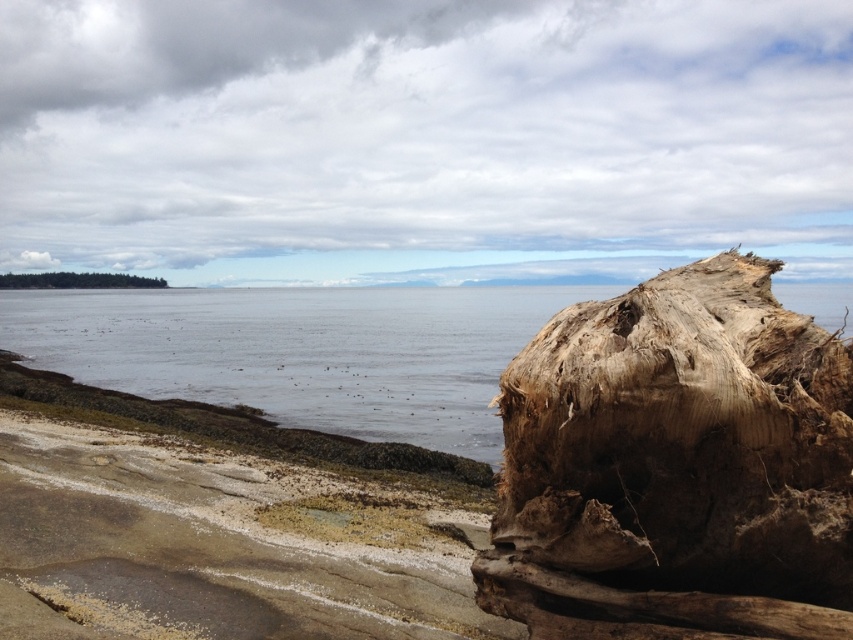
Question: Which point is farther to the camera?

Choices:
 (A) clear water at center
 (B) brown rough log at left

Answer: (B)

Question: Where is driftwood log at right located in relation to brown rough log at left in the image?

Choices:
 (A) below
 (B) above

Answer: (A)

Question: Is driftwood log at right to the right of brown rough log at left from the viewer's perspective?

Choices:
 (A) yes
 (B) no

Answer: (A)

Question: Which of the following is the farthest from the observer?

Choices:
 (A) brown rough log at left
 (B) clear water at center

Answer: (A)

Question: Can you confirm if driftwood log at right is positioned above clear water at center?

Choices:
 (A) yes
 (B) no

Answer: (B)

Question: Which object appears closest to the camera in this image?

Choices:
 (A) brown rough log at left
 (B) driftwood log at right
 (C) clear water at center

Answer: (B)